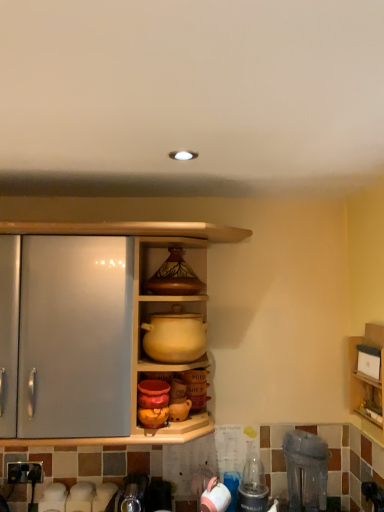
Locate an element on the screen. The width and height of the screenshot is (384, 512). matte ceramic vase at upper center is located at coordinates click(172, 267).

Describe the element at coordinates (175, 336) in the screenshot. This screenshot has height=512, width=384. I see `matte yellow pot at center, which appears as the second shelf when viewed from the right` at that location.

Describe the element at coordinates (215, 497) in the screenshot. This screenshot has width=384, height=512. I see `white glossy kettle at lower center, the second appliance from the right` at that location.

Find the location of a particular element. This screenshot has height=512, width=384. transparent plastic blender at lower right, the second appliance when ordered from left to right is located at coordinates (306, 470).

What is the approximate width of clear plastic bottle at lower right?

clear plastic bottle at lower right is 16.42 centimeters wide.

Where is `wooden shelf at right, acting as the 1th shelf starting from the right`? wooden shelf at right, acting as the 1th shelf starting from the right is located at coordinates (367, 381).

Image resolution: width=384 pixels, height=512 pixels. In order to click on matte ceramic vase at upper center in this screenshot , I will do `click(172, 267)`.

From a real-world perspective, is wooden shelf at right, acting as the second shelf starting from the left, physically located above or below matte yellow pot at center, which appears as the second shelf when viewed from the right?

wooden shelf at right, acting as the second shelf starting from the left, is below matte yellow pot at center, which appears as the second shelf when viewed from the right.

Is wooden shelf at right, acting as the 1th shelf starting from the right, facing away from matte yellow pot at center, which appears as the second shelf when viewed from the right?

wooden shelf at right, acting as the 1th shelf starting from the right, does not have its back to matte yellow pot at center, which appears as the second shelf when viewed from the right.

Is wooden shelf at right, acting as the 1th shelf starting from the right, smaller than matte yellow pot at center, which appears as the second shelf when viewed from the right?

Yes, wooden shelf at right, acting as the 1th shelf starting from the right, is smaller than matte yellow pot at center, which appears as the second shelf when viewed from the right.

Based on the photo, can you confirm if wooden shelf at right, acting as the 1th shelf starting from the right, is positioned to the left of matte yellow pot at center, acting as the first shelf starting from the left?

No.

Do you think wooden shelf at right, acting as the 1th shelf starting from the right, is within transparent plastic blender at lower right, arranged as the first appliance when viewed from the right, or outside of it?

wooden shelf at right, acting as the 1th shelf starting from the right, is located beyond the bounds of transparent plastic blender at lower right, arranged as the first appliance when viewed from the right.

In the scene shown: Can you confirm if wooden shelf at right, acting as the 1th shelf starting from the right, is positioned to the left of transparent plastic blender at lower right, the second appliance when ordered from left to right?

Incorrect, wooden shelf at right, acting as the 1th shelf starting from the right, is not on the left side of transparent plastic blender at lower right, the second appliance when ordered from left to right.

Can you tell me how much wooden shelf at right, acting as the second shelf starting from the left, and transparent plastic blender at lower right, arranged as the first appliance when viewed from the right, differ in facing direction?

The angular difference between wooden shelf at right, acting as the second shelf starting from the left, and transparent plastic blender at lower right, arranged as the first appliance when viewed from the right, is 52.9 degrees.

Which object is more forward, wooden shelf at right, acting as the second shelf starting from the left, or transparent plastic blender at lower right, arranged as the first appliance when viewed from the right?

Positioned in front is transparent plastic blender at lower right, arranged as the first appliance when viewed from the right.

Is matte ceramic vase at upper center positioned with its back to transparent plastic blender at lower right, the second appliance when ordered from left to right?

No, matte ceramic vase at upper center's orientation is not away from transparent plastic blender at lower right, the second appliance when ordered from left to right.

In the image, is matte ceramic vase at upper center positioned in front of or behind transparent plastic blender at lower right, the second appliance when ordered from left to right?

Clearly, matte ceramic vase at upper center is behind transparent plastic blender at lower right, the second appliance when ordered from left to right.

Based on the photo, is transparent plastic blender at lower right, the second appliance when ordered from left to right, inside matte ceramic vase at upper center?

No.

Considering the relative positions of matte ceramic vase at upper center and transparent plastic blender at lower right, arranged as the first appliance when viewed from the right, in the image provided, is matte ceramic vase at upper center to the left of transparent plastic blender at lower right, arranged as the first appliance when viewed from the right, from the viewer's perspective?

Yes, matte ceramic vase at upper center is to the left of transparent plastic blender at lower right, arranged as the first appliance when viewed from the right.

Is white glossy kettle at lower center, which is the first appliance from left to right, touching matte yellow pot at center, which appears as the second shelf when viewed from the right?

No, white glossy kettle at lower center, which is the first appliance from left to right, is not making contact with matte yellow pot at center, which appears as the second shelf when viewed from the right.

How many degrees apart are the facing directions of white glossy kettle at lower center, the second appliance from the right, and matte yellow pot at center, acting as the first shelf starting from the left?

The facing directions of white glossy kettle at lower center, the second appliance from the right, and matte yellow pot at center, acting as the first shelf starting from the left, are 1.21 degrees apart.

Is white glossy kettle at lower center, the second appliance from the right, wider or thinner than matte yellow pot at center, acting as the first shelf starting from the left?

In the image, white glossy kettle at lower center, the second appliance from the right, appears to be more narrow than matte yellow pot at center, acting as the first shelf starting from the left.

Is white glossy kettle at lower center, the second appliance from the right, taller or shorter than matte yellow pot at center, acting as the first shelf starting from the left?

In the image, white glossy kettle at lower center, the second appliance from the right, appears to be shorter than matte yellow pot at center, acting as the first shelf starting from the left.

Is transparent plastic blender at lower right, arranged as the first appliance when viewed from the right, taller or shorter than matte ceramic vase at upper center?

In the image, transparent plastic blender at lower right, arranged as the first appliance when viewed from the right, appears to be taller than matte ceramic vase at upper center.

Can you confirm if transparent plastic blender at lower right, the second appliance when ordered from left to right, is positioned to the right of matte ceramic vase at upper center?

Yes, transparent plastic blender at lower right, the second appliance when ordered from left to right, is to the right of matte ceramic vase at upper center.

How many degrees apart are the facing directions of transparent plastic blender at lower right, arranged as the first appliance when viewed from the right, and matte ceramic vase at upper center?

The angular difference between transparent plastic blender at lower right, arranged as the first appliance when viewed from the right, and matte ceramic vase at upper center is 40.6 degrees.

From the image's perspective, is transparent plastic blender at lower right, arranged as the first appliance when viewed from the right, located beneath matte ceramic vase at upper center?

Correct, transparent plastic blender at lower right, arranged as the first appliance when viewed from the right, appears lower than matte ceramic vase at upper center in the image.

From the image's perspective, does matte yellow pot at center, which appears as the second shelf when viewed from the right, appear higher than white glossy kettle at lower center, which is the first appliance from left to right?

Yes.

Which object is wider, matte yellow pot at center, acting as the first shelf starting from the left, or white glossy kettle at lower center, the second appliance from the right?

With larger width is matte yellow pot at center, acting as the first shelf starting from the left.

Could you measure the distance between matte yellow pot at center, which appears as the second shelf when viewed from the right, and white glossy kettle at lower center, the second appliance from the right?

matte yellow pot at center, which appears as the second shelf when viewed from the right, is 24.41 inches away from white glossy kettle at lower center, the second appliance from the right.

Considering the relative sizes of matte yellow pot at center, which appears as the second shelf when viewed from the right, and white glossy kettle at lower center, which is the first appliance from left to right, in the image provided, is matte yellow pot at center, which appears as the second shelf when viewed from the right, shorter than white glossy kettle at lower center, which is the first appliance from left to right,?

Incorrect, the height of matte yellow pot at center, which appears as the second shelf when viewed from the right, does not fall short of that of white glossy kettle at lower center, which is the first appliance from left to right.

Is the depth of white glossy kettle at lower center, which is the first appliance from left to right, less than that of wooden shelf at right, acting as the 1th shelf starting from the right?

That is False.

In terms of width, does white glossy kettle at lower center, which is the first appliance from left to right, look wider or thinner when compared to wooden shelf at right, acting as the second shelf starting from the left?

Clearly, white glossy kettle at lower center, which is the first appliance from left to right, has more width compared to wooden shelf at right, acting as the second shelf starting from the left.

From the image's perspective, relative to wooden shelf at right, acting as the second shelf starting from the left, is white glossy kettle at lower center, the second appliance from the right, above or below?

Clearly, from the image's perspective, white glossy kettle at lower center, the second appliance from the right, is below wooden shelf at right, acting as the second shelf starting from the left.

Is white glossy kettle at lower center, the second appliance from the right, directly adjacent to wooden shelf at right, acting as the 1th shelf starting from the right?

No, white glossy kettle at lower center, the second appliance from the right, is not next to wooden shelf at right, acting as the 1th shelf starting from the right.

Where is `shelf located underneath the matte yellow pot at center, acting as the first shelf starting from the left (from a real-world perspective)`? shelf located underneath the matte yellow pot at center, acting as the first shelf starting from the left (from a real-world perspective) is located at coordinates (367, 381).

This screenshot has height=512, width=384. I want to click on shelf that is the 1st object located behind the transparent plastic blender at lower right, the second appliance when ordered from left to right, so click(367, 381).

From the image, which object appears to be nearer to transparent plastic blender at lower right, arranged as the first appliance when viewed from the right, wooden shelf at right, acting as the second shelf starting from the left, or white glossy kettle at lower center, the second appliance from the right?

wooden shelf at right, acting as the second shelf starting from the left, is positioned closer to the anchor transparent plastic blender at lower right, arranged as the first appliance when viewed from the right.

Considering their positions, is transparent plastic blender at lower right, the second appliance when ordered from left to right, positioned closer to matte ceramic vase at upper center than white glossy kettle at lower center, the second appliance from the right?

Based on the image, transparent plastic blender at lower right, the second appliance when ordered from left to right, appears to be nearer to matte ceramic vase at upper center.

From the image, which object appears to be farther from transparent plastic blender at lower right, arranged as the first appliance when viewed from the right, matte yellow pot at center, which appears as the second shelf when viewed from the right, or wooden shelf at right, acting as the 1th shelf starting from the right?

matte yellow pot at center, which appears as the second shelf when viewed from the right, is positioned further to the anchor transparent plastic blender at lower right, arranged as the first appliance when viewed from the right.

In the scene shown: Based on their spatial positions, is transparent plastic blender at lower right, arranged as the first appliance when viewed from the right, or clear plastic bottle at lower right further from matte yellow pot at center, which appears as the second shelf when viewed from the right?

clear plastic bottle at lower right.

Which object lies further to the anchor point matte ceramic vase at upper center, matte yellow pot at center, which appears as the second shelf when viewed from the right, or wooden shelf at right, acting as the second shelf starting from the left?

wooden shelf at right, acting as the second shelf starting from the left, is positioned further to the anchor matte ceramic vase at upper center.

Which object lies further to the anchor point transparent plastic blender at lower right, the second appliance when ordered from left to right, clear plastic bottle at lower right or matte ceramic vase at upper center?

matte ceramic vase at upper center lies further to transparent plastic blender at lower right, the second appliance when ordered from left to right, than the other object.

In the scene shown: Looking at the image, which one is located closer to transparent plastic blender at lower right, arranged as the first appliance when viewed from the right, white glossy kettle at lower center, which is the first appliance from left to right, or clear plastic bottle at lower right?

clear plastic bottle at lower right is closer to transparent plastic blender at lower right, arranged as the first appliance when viewed from the right.

From the picture: Which object lies further to the anchor point matte yellow pot at center, acting as the first shelf starting from the left, transparent plastic blender at lower right, the second appliance when ordered from left to right, or wooden shelf at right, acting as the 1th shelf starting from the right?

The object further to matte yellow pot at center, acting as the first shelf starting from the left, is wooden shelf at right, acting as the 1th shelf starting from the right.

In order to click on bottle between matte yellow pot at center, acting as the first shelf starting from the left, and wooden shelf at right, acting as the second shelf starting from the left, from left to right in this screenshot , I will do `click(252, 483)`.

Where is `appliance between matte yellow pot at center, acting as the first shelf starting from the left, and white glossy kettle at lower center, which is the first appliance from left to right, vertically`? This screenshot has height=512, width=384. appliance between matte yellow pot at center, acting as the first shelf starting from the left, and white glossy kettle at lower center, which is the first appliance from left to right, vertically is located at coordinates (306, 470).

Where is `appliance between matte ceramic vase at upper center and white glossy kettle at lower center, which is the first appliance from left to right, from top to bottom`? appliance between matte ceramic vase at upper center and white glossy kettle at lower center, which is the first appliance from left to right, from top to bottom is located at coordinates (306, 470).

Locate an element on the screen. The image size is (384, 512). bottle between white glossy kettle at lower center, which is the first appliance from left to right, and wooden shelf at right, acting as the 1th shelf starting from the right, from left to right is located at coordinates (252, 483).